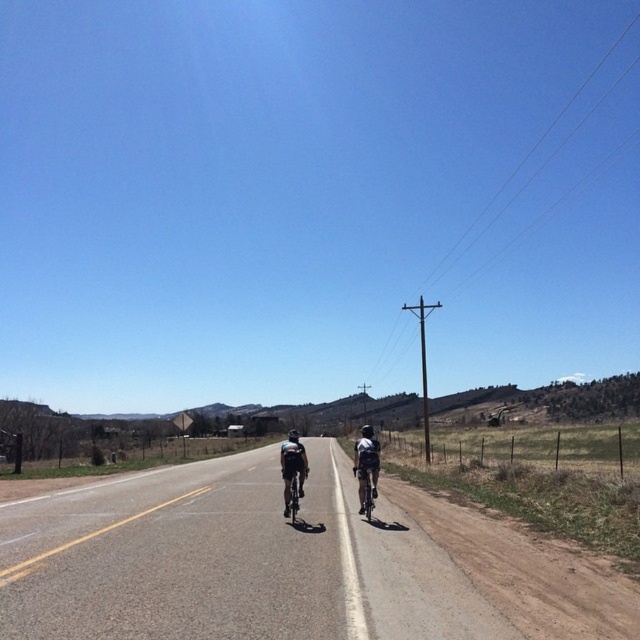
Question: Can you confirm if asphalt road at center is smaller than shiny metallic bicycle at center?

Choices:
 (A) yes
 (B) no

Answer: (B)

Question: Which of the following is the closest to the observer?

Choices:
 (A) (371, 490)
 (B) (291, 516)

Answer: (B)

Question: Which point is closer to the camera taking this photo?

Choices:
 (A) (369, 516)
 (B) (314, 529)
 (C) (292, 522)

Answer: (B)

Question: Does asphalt road at center have a greater width compared to shiny metallic bicycle at center?

Choices:
 (A) no
 (B) yes

Answer: (B)

Question: Considering the real-world distances, which object is closest to the asphalt road at center?

Choices:
 (A) shiny silver bicycle at center
 (B) shiny metallic bicycle at center

Answer: (A)

Question: Can you confirm if asphalt road at center is positioned below shiny silver bicycle at center?

Choices:
 (A) yes
 (B) no

Answer: (A)